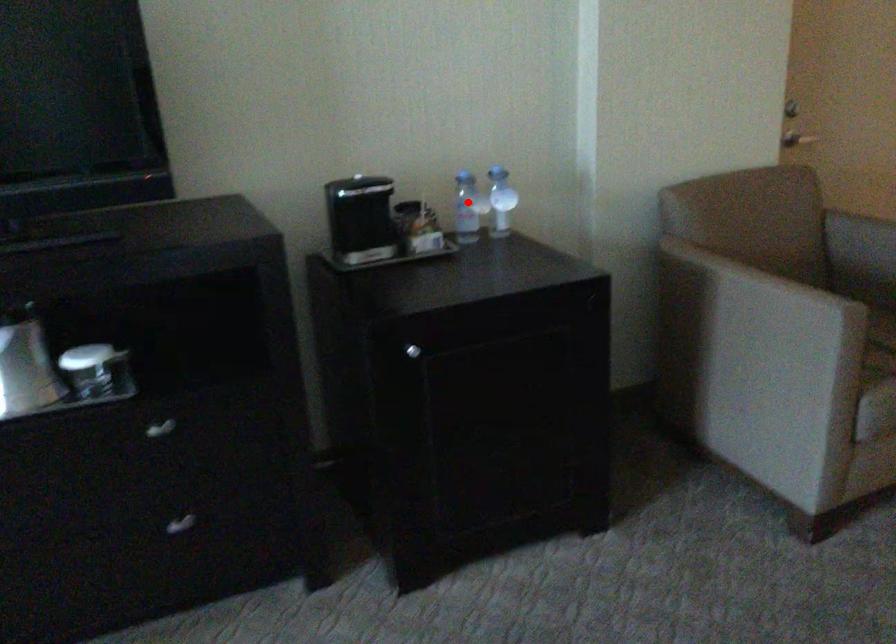
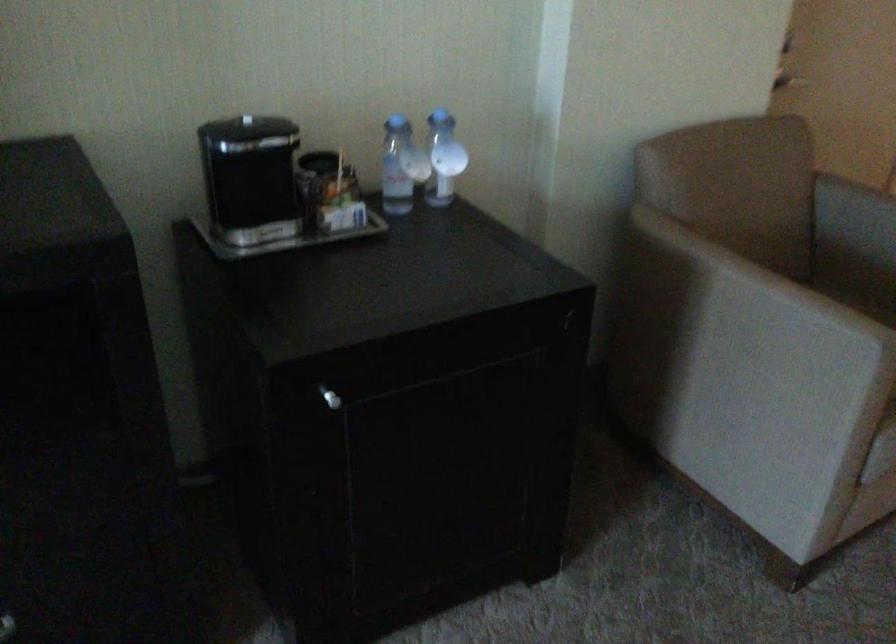
Question: I am providing you with two images of the same scene from different viewpoints. In image1, a red point is highlighted. Considering the same 3D point in image2, which of the following is correct?

Choices:
 (A) It is closer
 (B) It is farther

Answer: (A)